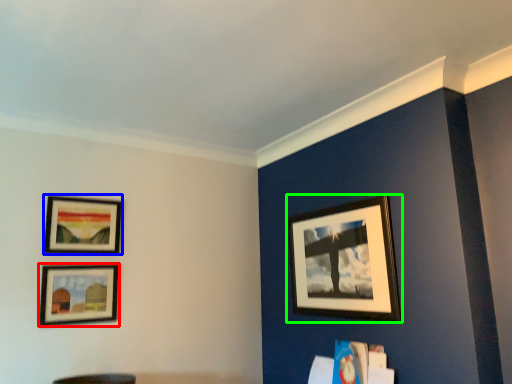
Question: Estimate the real-world distances between objects in this image. Which object is farther from picture frame (highlighted by a red box), picture frame (highlighted by a blue box) or picture frame (highlighted by a green box)?

Choices:
 (A) picture frame
 (B) picture frame

Answer: (B)